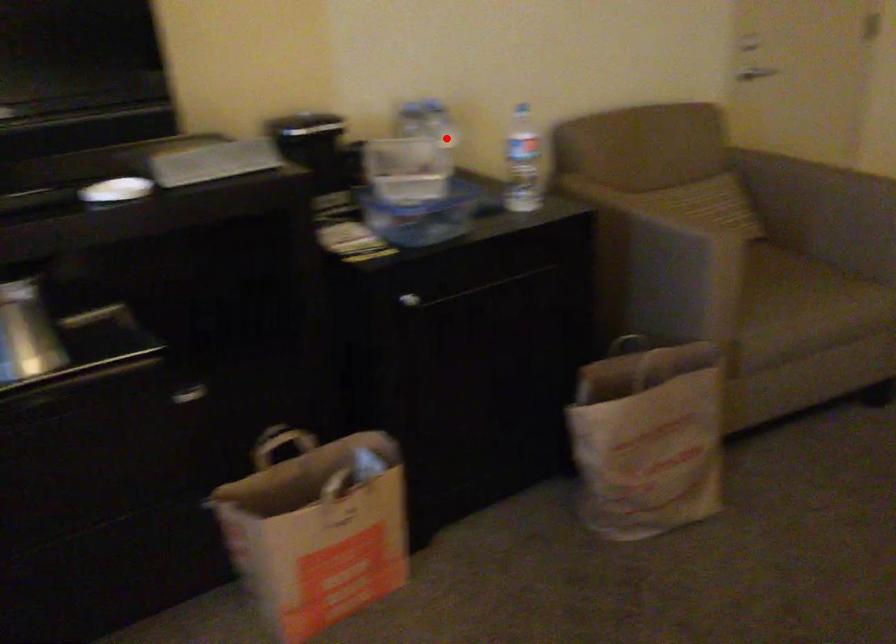
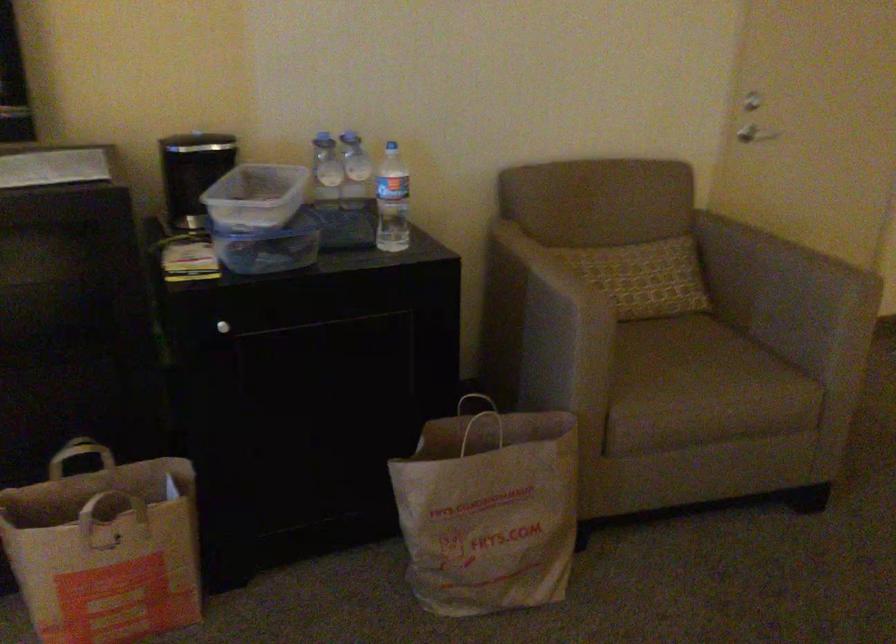
Where in the second image is the point corresponding to the highlighted location from the first image?

(355, 171)